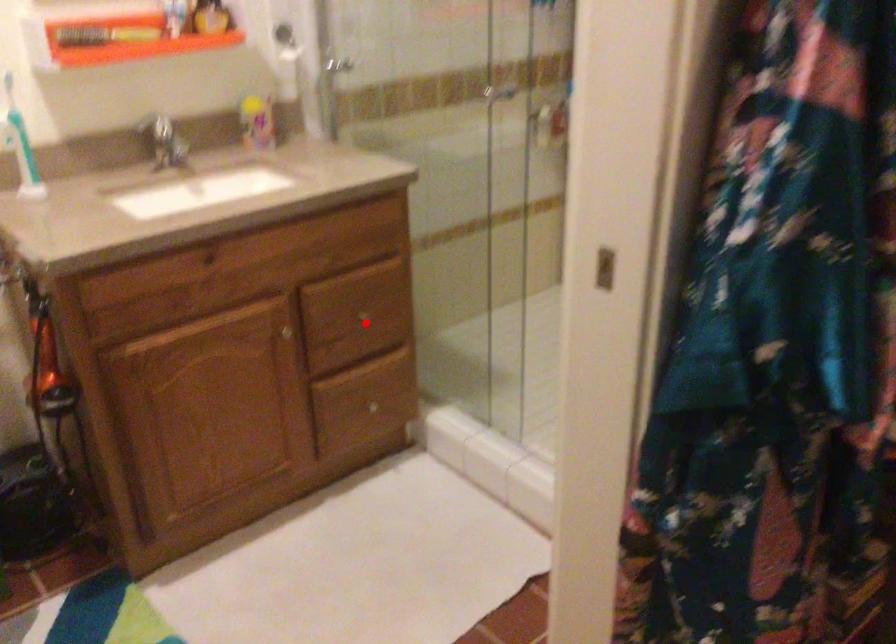
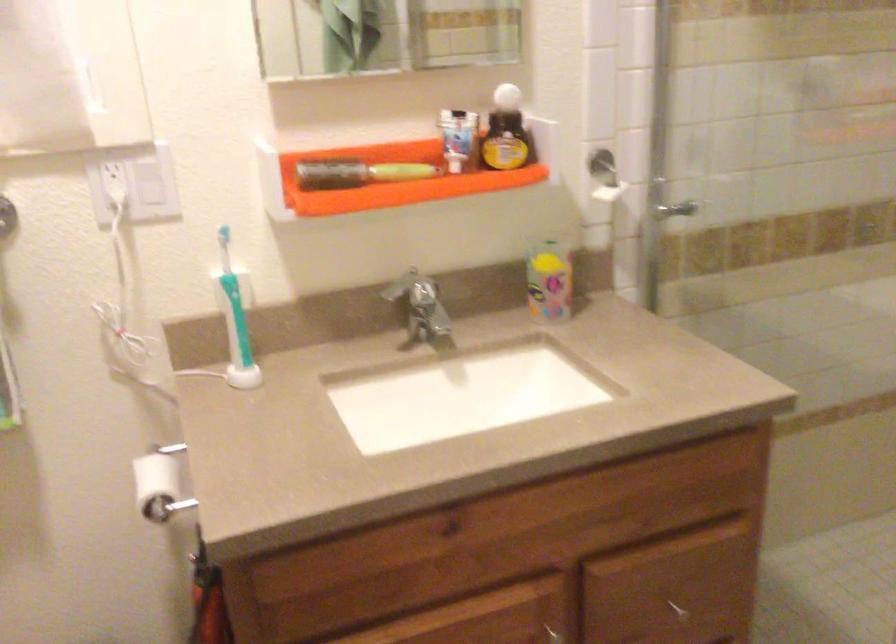
Question: I am providing you with two images of the same scene from different viewpoints. Image1 has a red point marked. In image2, the corresponding 3D location appears at what relative position? Reply with the corresponding letter.

Choices:
 (A) Closer
 (B) Farther

Answer: (A)